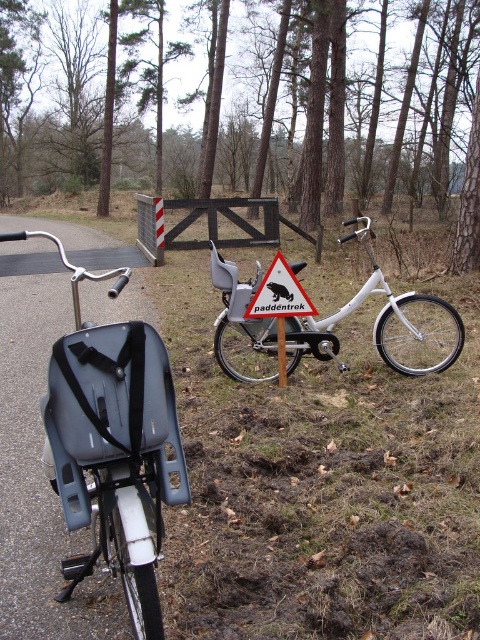
Is point (427, 342) farther from camera compared to point (276, 307)?

Yes, it is.

You are a GUI agent. You are given a task and a screenshot of the screen. Output one action in this format:
    pyautogui.click(x=<x>, y=<y>)
    Task: Click on the white matte bicycle at center
    
    Given the screenshot: What is the action you would take?
    pyautogui.click(x=376, y=323)

Does point (427, 337) lie behind point (276, 316)?

That is True.

Locate an element on the screen. The image size is (480, 640). white matte bicycle at center is located at coordinates (376, 323).

Who is lower down, brown wood tree at upper center or matte black bicycle seat at center?

matte black bicycle seat at center is lower down.

Can you confirm if brown wood tree at upper center is positioned to the left of matte black bicycle seat at center?

Yes, brown wood tree at upper center is to the left of matte black bicycle seat at center.

The image size is (480, 640). Find the location of `brown wood tree at upper center`. brown wood tree at upper center is located at coordinates (372, 113).

Can you confirm if matte black bicycle seat at center is bigger than white matte bicycle at center?

No, matte black bicycle seat at center is not bigger than white matte bicycle at center.

Who is higher up, matte black bicycle seat at center or white matte bicycle at center?

white matte bicycle at center is higher up.

Measure the distance between point (86, 516) and camera.

1.95 meters

The width and height of the screenshot is (480, 640). Identify the location of matte black bicycle seat at center. (112, 444).